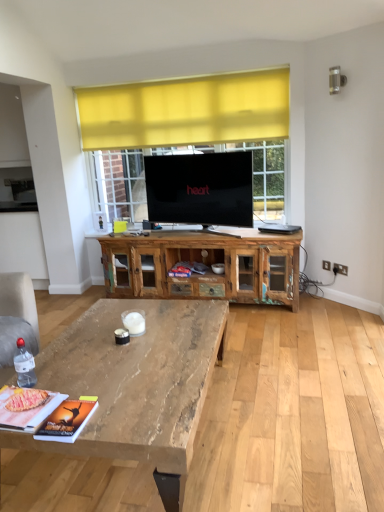
The width and height of the screenshot is (384, 512). What are the coordinates of `spots to the right of natural wood coffee table at lower left` in the screenshot? It's located at (293, 405).